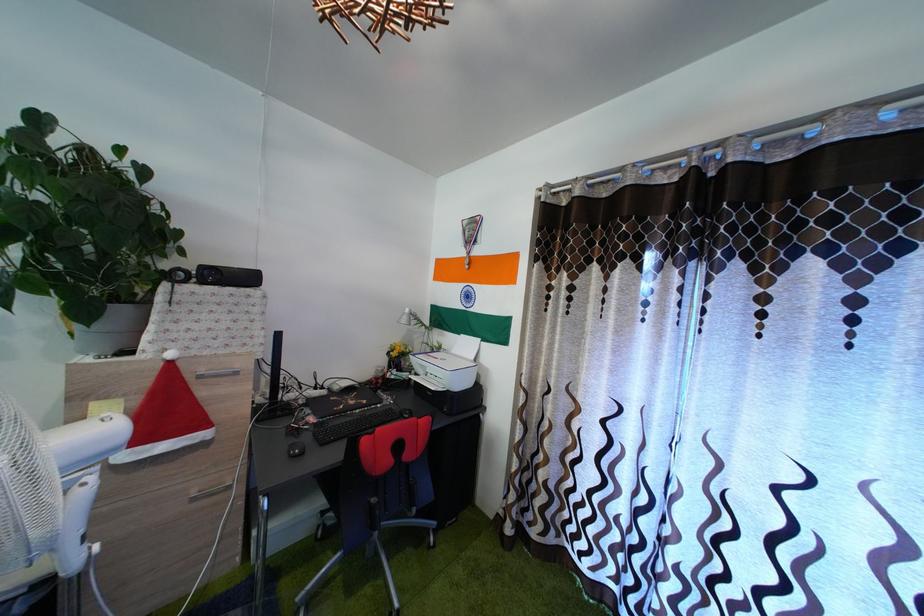
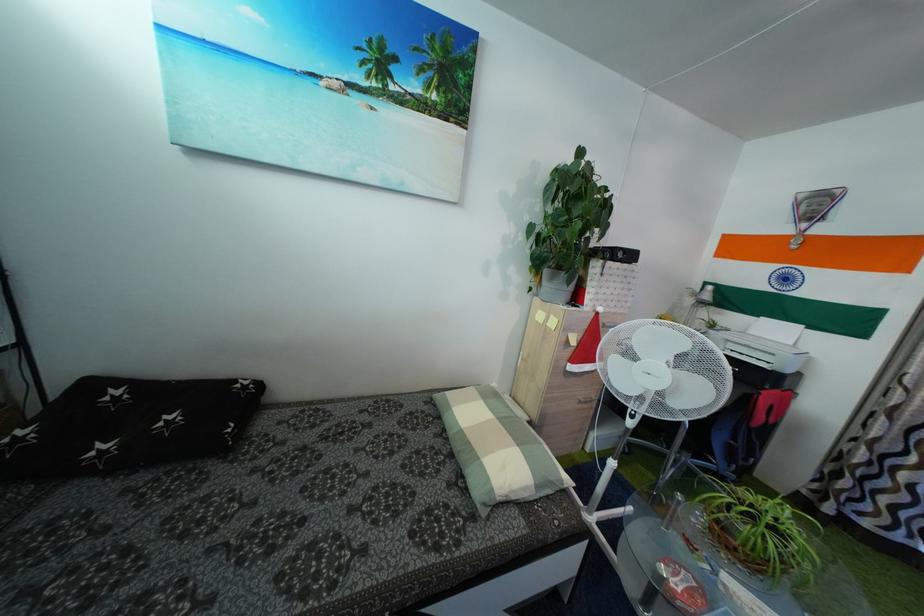
Which direction would the cameraman need to move to produce the second image?

The cameraman walked toward left, backward.